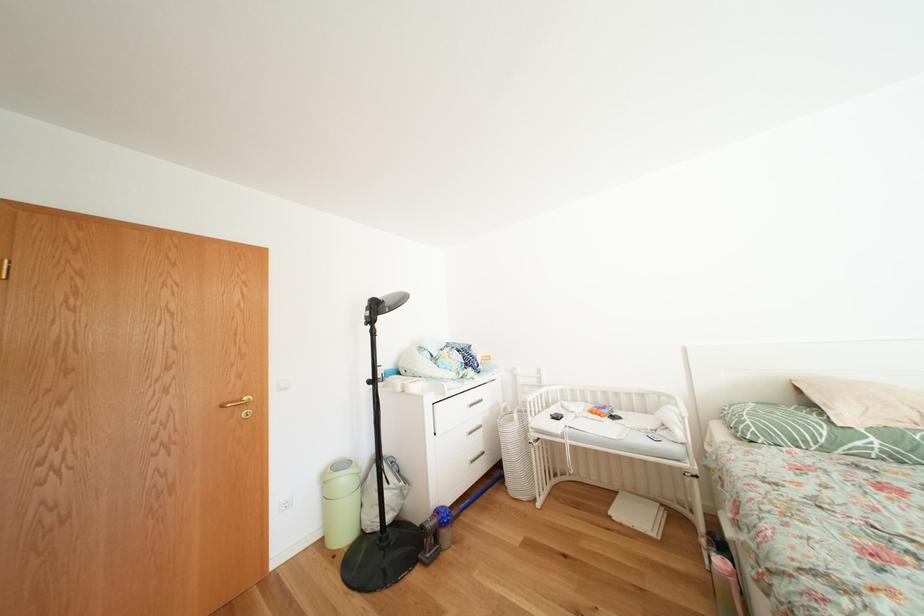
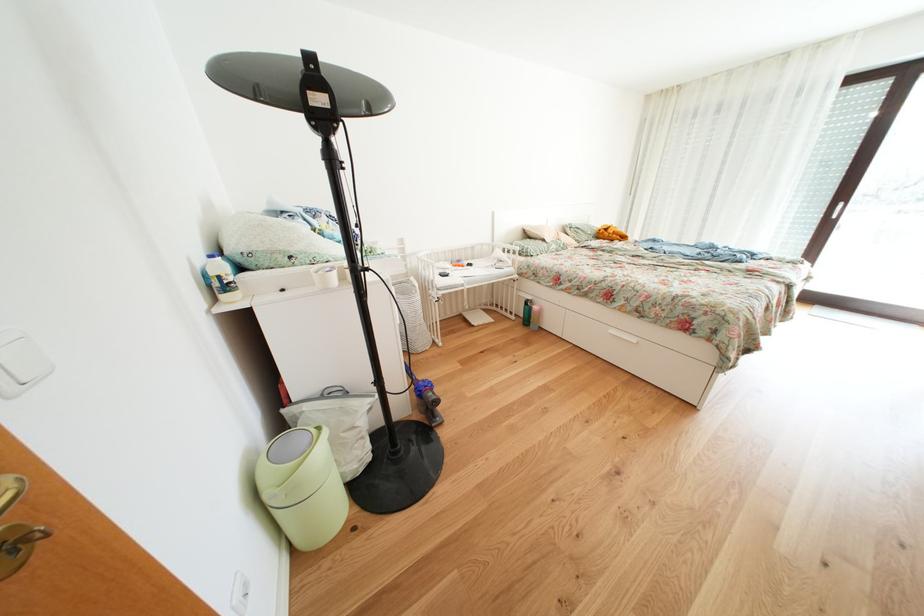
Find the pixel in the second image that matches (x=718, y=568) in the first image.

(523, 323)